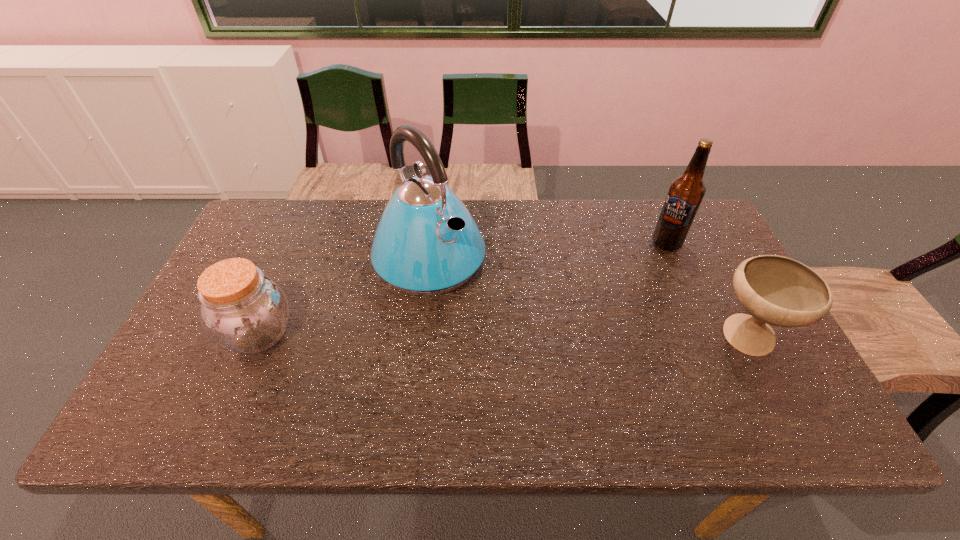
You are a GUI agent. You are given a task and a screenshot of the screen. Output one action in this format:
    pyautogui.click(x=<x>, y=<y>)
    Task: Click on the leftmost object
    This screenshot has width=960, height=540.
    Given the screenshot: What is the action you would take?
    pyautogui.click(x=243, y=310)

At what (x,y) coordinates should I click in order to perform the action: click on chalice. Please return your answer as a coordinate pair (x, y). This screenshot has height=540, width=960. Looking at the image, I should click on (776, 290).

Locate an element on the screen. The image size is (960, 540). the second object from left to right is located at coordinates pos(426,243).

Image resolution: width=960 pixels, height=540 pixels. Find the location of `kettle`. kettle is located at coordinates (426, 243).

Find the location of a particular element. This screenshot has height=540, width=960. beer bottle is located at coordinates (686, 192).

In order to click on vacant space located on the back of the leftmost object in this screenshot , I will do `click(311, 213)`.

Locate an element on the screen. This screenshot has height=540, width=960. vacant space located on the back of the chalice is located at coordinates (706, 258).

In order to click on vacant region located at the spout of the tallest object in this screenshot , I will do `click(521, 350)`.

The height and width of the screenshot is (540, 960). I want to click on vacant space positioned at the spout of the tallest object, so click(x=479, y=309).

Find the location of `vacant space located 0.220m at the spout of the tallest object`. vacant space located 0.220m at the spout of the tallest object is located at coordinates (516, 345).